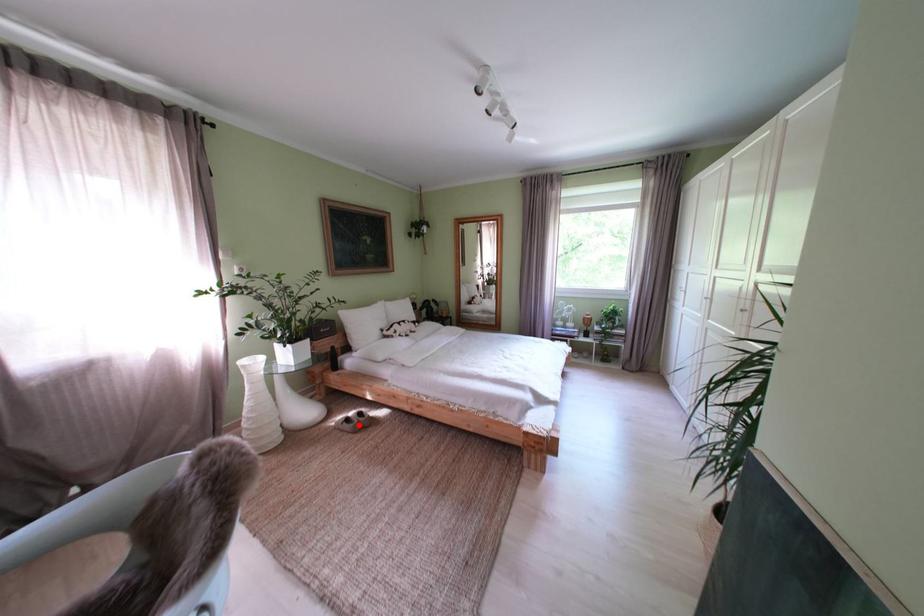
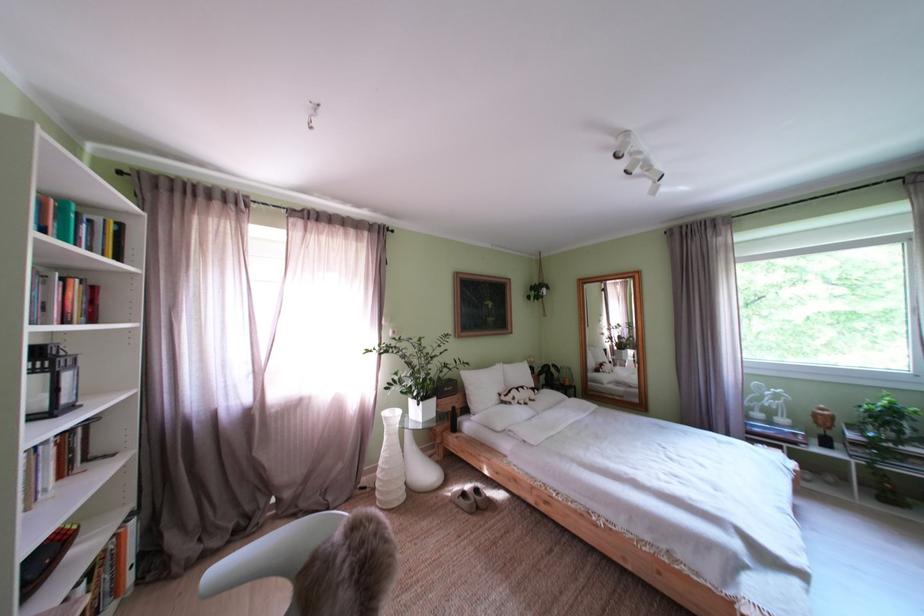
Find the pixel in the second image that matches the highlighted location in the first image.

(475, 500)